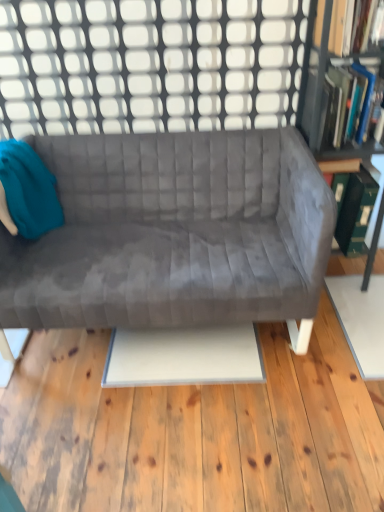
Question: Can you confirm if teal fabric bean bag chair at left is wider than hardcover book at upper right, placed as the 1th book when sorted from top to bottom?

Choices:
 (A) yes
 (B) no

Answer: (B)

Question: Can you see teal fabric bean bag chair at left touching hardcover book at upper right, placed as the 1th book when sorted from top to bottom?

Choices:
 (A) yes
 (B) no

Answer: (B)

Question: From the image's perspective, is teal fabric bean bag chair at left above hardcover book at upper right, which is counted as the 2th book, starting from the bottom?

Choices:
 (A) no
 (B) yes

Answer: (A)

Question: From a real-world perspective, is teal fabric bean bag chair at left positioned under hardcover book at upper right, which is counted as the 2th book, starting from the bottom, based on gravity?

Choices:
 (A) no
 (B) yes

Answer: (B)

Question: Does teal fabric bean bag chair at left turn towards hardcover book at upper right, placed as the 1th book when sorted from top to bottom?

Choices:
 (A) no
 (B) yes

Answer: (A)

Question: Does teal fabric bean bag chair at left have a greater height compared to hardcover book at upper right, placed as the 1th book when sorted from top to bottom?

Choices:
 (A) no
 (B) yes

Answer: (B)

Question: Can you confirm if green cardboard bookcase at right is bigger than hardcover book at upper right, placed as the 1th book when sorted from top to bottom?

Choices:
 (A) yes
 (B) no

Answer: (A)

Question: Is green cardboard bookcase at right at the right side of hardcover book at upper right, which is counted as the 2th book, starting from the bottom?

Choices:
 (A) no
 (B) yes

Answer: (B)

Question: From the image's perspective, would you say green cardboard bookcase at right is shown under hardcover book at upper right, which is counted as the 2th book, starting from the bottom?

Choices:
 (A) no
 (B) yes

Answer: (B)

Question: Is green cardboard bookcase at right next to hardcover book at upper right, placed as the 1th book when sorted from top to bottom, and touching it?

Choices:
 (A) yes
 (B) no

Answer: (B)

Question: Is green cardboard bookcase at right located outside hardcover book at upper right, placed as the 1th book when sorted from top to bottom?

Choices:
 (A) no
 (B) yes

Answer: (B)

Question: Can you confirm if green cardboard bookcase at right is thinner than hardcover book at upper right, which is counted as the 2th book, starting from the bottom?

Choices:
 (A) no
 (B) yes

Answer: (A)

Question: Is hardcover book at upper right, which is counted as the 2th book, starting from the bottom, directly adjacent to hardcover book at upper right, which appears as the 1th book when ordered from the bottom?

Choices:
 (A) yes
 (B) no

Answer: (B)